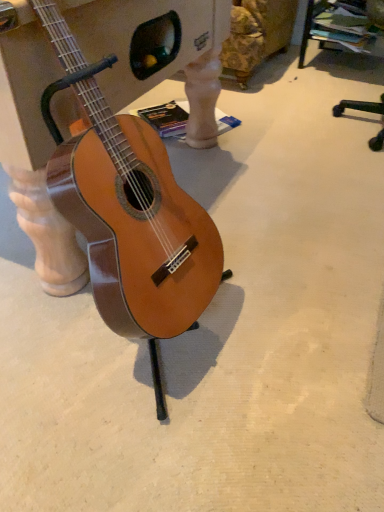
Image resolution: width=384 pixels, height=512 pixels. In order to click on vacant area to the right of natural wood guitar at center in this screenshot , I will do `click(291, 321)`.